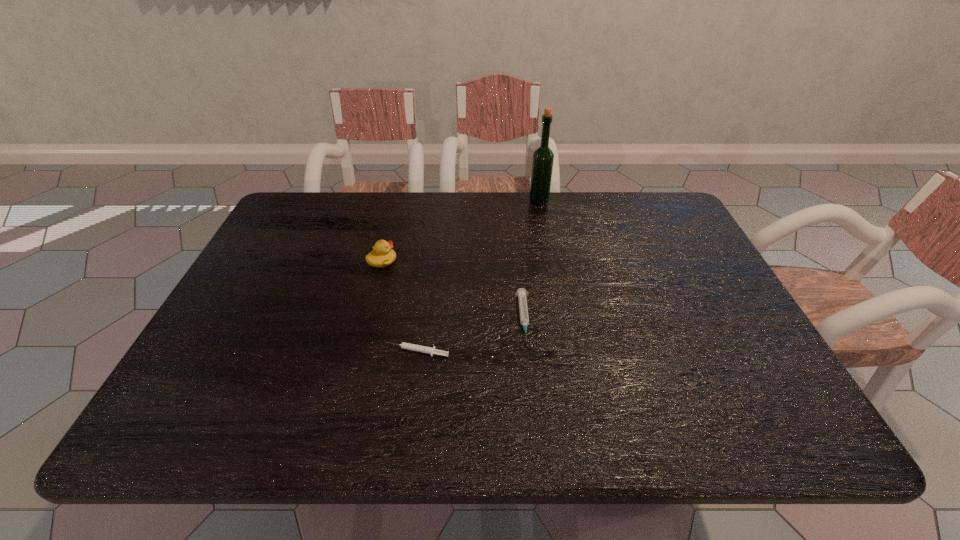
Where is `vacant region located at the needle end of the right syringe`? This screenshot has height=540, width=960. vacant region located at the needle end of the right syringe is located at coordinates (532, 400).

You are a GUI agent. You are given a task and a screenshot of the screen. Output one action in this format:
    pyautogui.click(x=<x>, y=<y>)
    Task: Click on the free space located on the front of the shorter syringe
    
    Given the screenshot: What is the action you would take?
    pyautogui.click(x=409, y=408)

Image resolution: width=960 pixels, height=540 pixels. Identify the location of object that is at the far edge. (542, 164).

In the image, there is a desktop. Where is `vacant space at the far edge`? vacant space at the far edge is located at coordinates (407, 194).

In the image, there is a desktop. At what (x,y) coordinates should I click in order to perform the action: click on vacant space at the near edge. Please return your answer as a coordinate pair (x, y). Image resolution: width=960 pixels, height=540 pixels. Looking at the image, I should click on (565, 426).

In the image, there is a desktop. Where is `free space at the left edge`? The height and width of the screenshot is (540, 960). free space at the left edge is located at coordinates [x=313, y=251].

Locate an element on the screen. vacant area at the far left corner is located at coordinates (330, 218).

In order to click on vacant space at the near left corner in this screenshot , I will do 218,406.

Find the location of `vacant position at the far right corner of the desktop`. vacant position at the far right corner of the desktop is located at coordinates (663, 207).

I want to click on free space between the leftmost object and the right syringe, so click(453, 289).